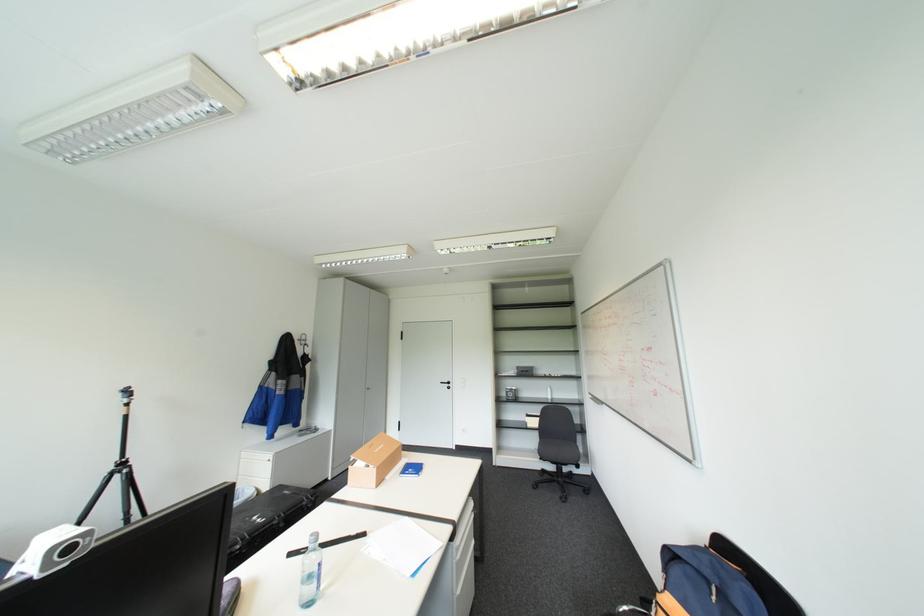
Locate an element on the screen. The height and width of the screenshot is (616, 924). grey cabinet handle is located at coordinates (445, 384).